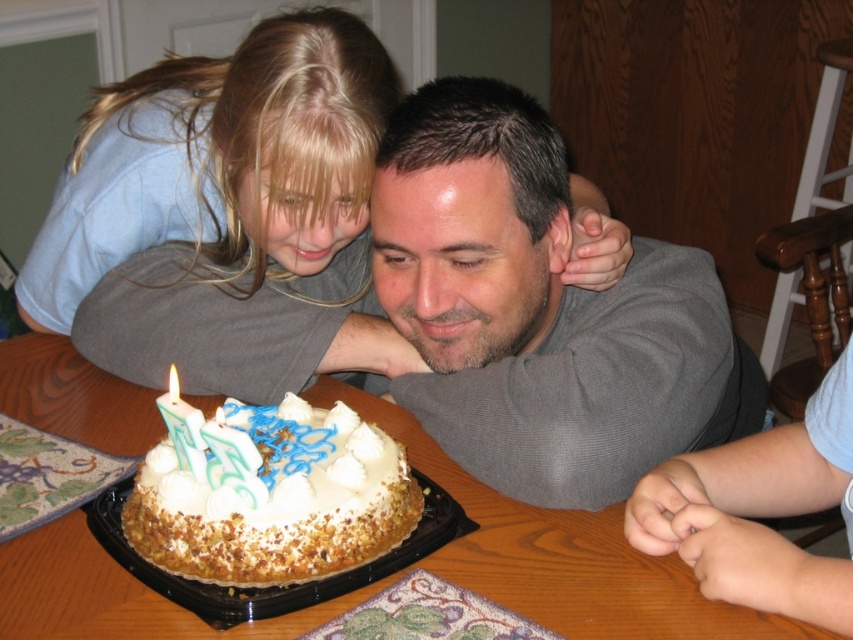
Question: Can you confirm if white frosted cake at center is positioned below green wax candle at center?

Choices:
 (A) no
 (B) yes

Answer: (B)

Question: Observing the image, what is the correct spatial positioning of blonde hair at upper left in reference to wooden table at center?

Choices:
 (A) left
 (B) right

Answer: (A)

Question: Which of the following is the farthest from the observer?

Choices:
 (A) (357, 438)
 (B) (175, 381)
 (C) (469, 577)
 (D) (231, 196)

Answer: (D)

Question: Is wooden table at center behind green wax candle at center?

Choices:
 (A) no
 (B) yes

Answer: (A)

Question: Among these points, which one is nearest to the camera?

Choices:
 (A) (419, 250)
 (B) (128, 108)
 (C) (15, 621)

Answer: (C)

Question: Estimate the real-world distances between objects in this image. Which object is closer to the green wax candle at center?

Choices:
 (A) white frosted cake at center
 (B) gray fabric shirt at center
 (C) wooden table at center

Answer: (A)